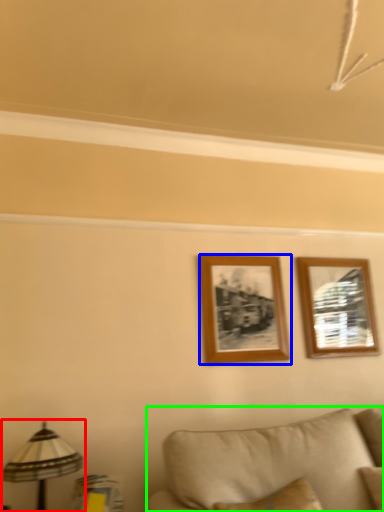
Question: Estimate the real-world distances between objects in this image. Which object is closer to table lamp (highlighted by a red box), picture frame (highlighted by a blue box) or studio couch (highlighted by a green box)?

Choices:
 (A) picture frame
 (B) studio couch

Answer: (B)